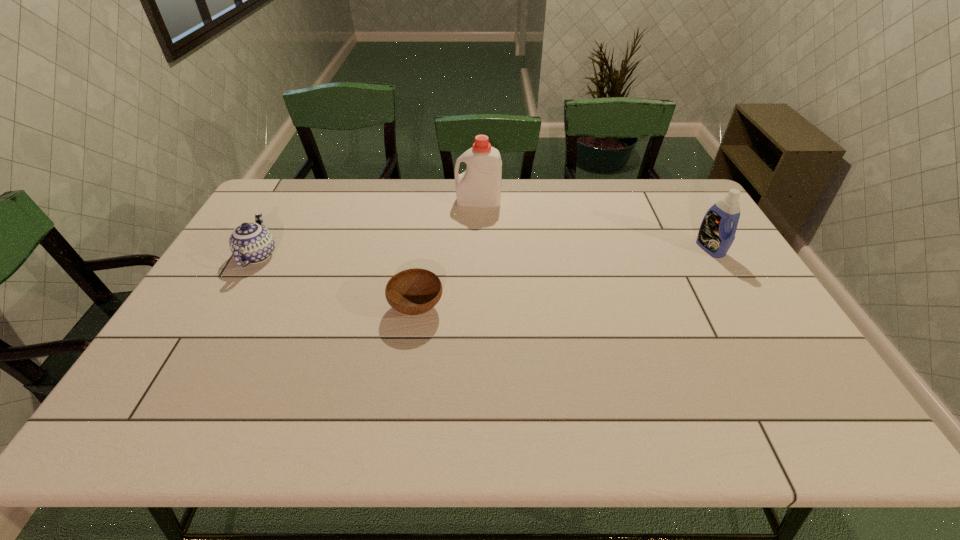
Locate an element on the screen. The height and width of the screenshot is (540, 960). vacant area at the near edge is located at coordinates click(549, 412).

The width and height of the screenshot is (960, 540). In the image, there is a desktop. What are the coordinates of `free space at the left edge` in the screenshot? It's located at (246, 302).

This screenshot has width=960, height=540. Identify the location of vacant space at the right edge. (753, 338).

This screenshot has width=960, height=540. In order to click on vacant space at the far left corner of the desktop in this screenshot , I will do `click(288, 185)`.

Locate an element on the screen. This screenshot has height=540, width=960. vacant region between the left detergent and the second shortest object is located at coordinates (368, 228).

Image resolution: width=960 pixels, height=540 pixels. What are the coordinates of `vacant point located between the farther detergent and the nearest object` in the screenshot? It's located at (447, 254).

Where is `free space between the chinaware and the second object from left to right`? free space between the chinaware and the second object from left to right is located at coordinates (337, 282).

This screenshot has height=540, width=960. Identify the location of vacant point located between the leftmost object and the third object from right to left. (337, 282).

You are a GUI agent. You are given a task and a screenshot of the screen. Output one action in this format:
    pyautogui.click(x=<x>, y=<y>)
    Task: Click on the vacant space that is in between the chinaware and the right detergent
    The image size is (960, 540).
    Given the screenshot: What is the action you would take?
    pyautogui.click(x=484, y=252)

Where is `vacant area that lies between the nearest object and the second shortest object`? vacant area that lies between the nearest object and the second shortest object is located at coordinates coord(337,282).